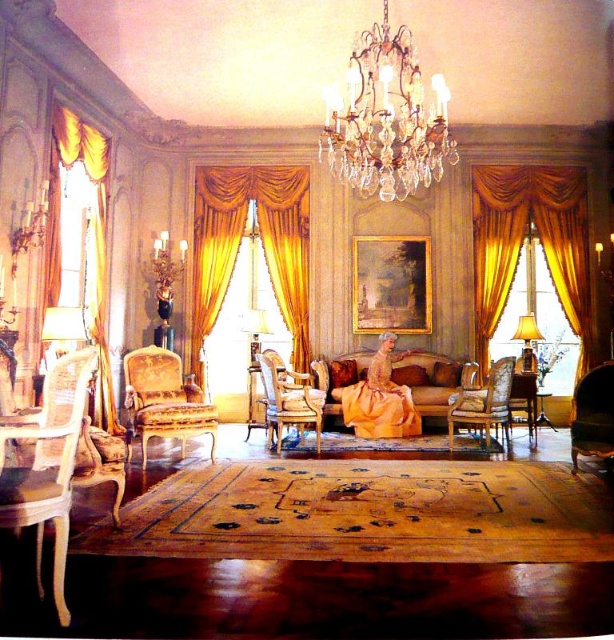
In the scene shown: Is gold velvet curtains at center smaller than light brown wood armchair at left?

No, gold velvet curtains at center is not smaller than light brown wood armchair at left.

Is gold velvet curtains at center in front of light brown wood armchair at left?

No, gold velvet curtains at center is further to the viewer.

What are the coordinates of `gold velvet curtains at center` in the screenshot? It's located at (241, 241).

At what (x,y) coordinates should I click in order to perform the action: click on gold velvet curtains at center. Please return your answer as a coordinate pair (x, y). Image resolution: width=614 pixels, height=640 pixels. Looking at the image, I should click on (241, 241).

Which is above, crystal/glass chandelier at upper center or gold-patterned fabric armchair at center-left?

crystal/glass chandelier at upper center is higher up.

Which is in front, point (335, 134) or point (152, 368)?

Point (335, 134) is in front.

What do you see at coordinates (386, 118) in the screenshot?
I see `crystal/glass chandelier at upper center` at bounding box center [386, 118].

You are a GUI agent. You are given a task and a screenshot of the screen. Output one action in this format:
    pyautogui.click(x=<x>, y=<y>)
    Task: Click on the crystal/glass chandelier at upper center
    
    Given the screenshot: What is the action you would take?
    click(x=386, y=118)

Consider the image. Between velvet beige couch at center and velvet dark green armchair at lower right, which one has more height?

With more height is velvet dark green armchair at lower right.

Which is below, velvet beige couch at center or velvet dark green armchair at lower right?

velvet dark green armchair at lower right is lower down.

Which is behind, point (460, 381) or point (607, 384)?

The point (460, 381) is behind.

Locate an element on the screen. velvet beige couch at center is located at coordinates (429, 380).